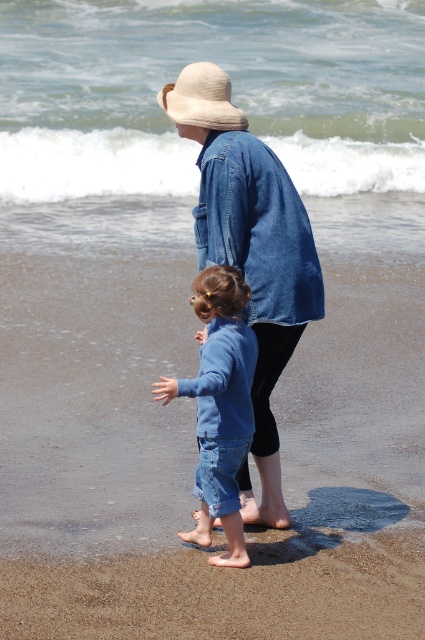
Describe the element at coordinates (220, 404) in the screenshot. I see `blue denim jeans at center` at that location.

Image resolution: width=425 pixels, height=640 pixels. I want to click on blue denim jeans at center, so click(x=220, y=404).

This screenshot has height=640, width=425. What are the coordinates of `blue denim jeans at center` in the screenshot? It's located at (220, 404).

Between denim jacket at center and beige woven hat at upper center, which one appears on the left side from the viewer's perspective?

beige woven hat at upper center is more to the left.

Can you confirm if denim jacket at center is bigger than beige woven hat at upper center?

Indeed, denim jacket at center has a larger size compared to beige woven hat at upper center.

Does point (291, 208) come farther from viewer compared to point (238, 128)?

That is False.

Locate an element on the screen. The width and height of the screenshot is (425, 640). denim jacket at center is located at coordinates (249, 252).

Is denim jacket at center wider than blue denim jeans at center?

Yes, denim jacket at center is wider than blue denim jeans at center.

Is point (280, 209) in front of point (212, 276)?

No, (280, 209) is further to viewer.

The width and height of the screenshot is (425, 640). What do you see at coordinates (249, 252) in the screenshot?
I see `denim jacket at center` at bounding box center [249, 252].

Identify the location of denim jacket at center. The height and width of the screenshot is (640, 425). 249,252.